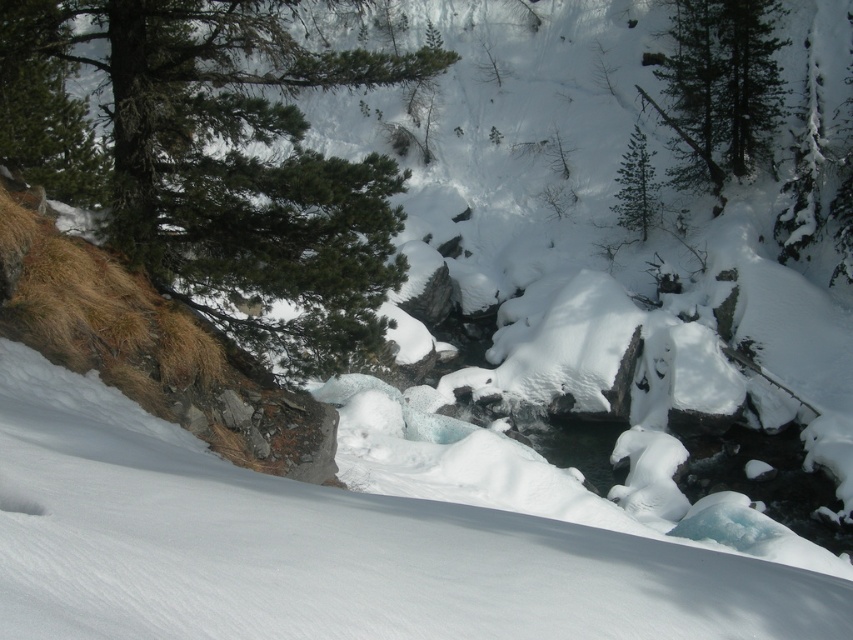
You are standing at the bottom of the snowfield and want to reach the top. You see two points marked on the slope. Which point is closer to you, point [1,44] or point [751,93]?

Point [1,44] is closer to the viewer than point [751,93], so the closer point is point [1,44].